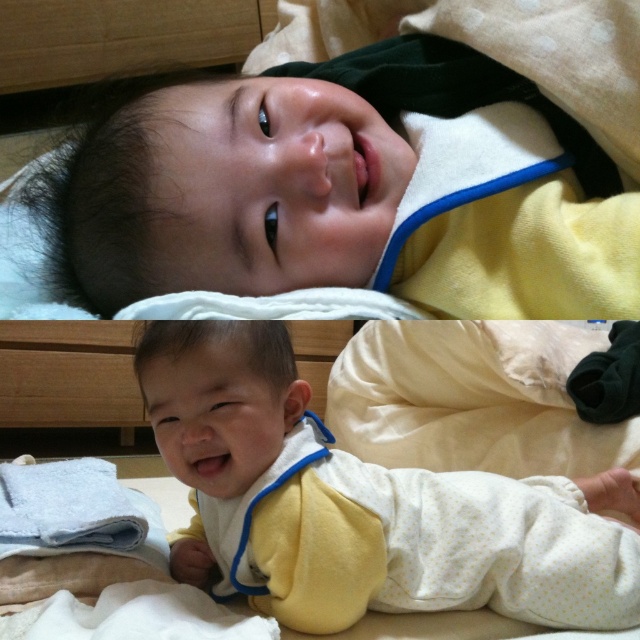
Question: Which point appears closest to the camera in this image?

Choices:
 (A) (561, 109)
 (B) (250, 480)

Answer: (A)

Question: Where is yellow fleece baby at upper center located in relation to yellow dotted fabric at center in the image?

Choices:
 (A) below
 (B) above

Answer: (B)

Question: Which point is closer to the camera?

Choices:
 (A) (202, 445)
 (B) (602, 161)

Answer: (B)

Question: From the image, what is the correct spatial relationship of yellow fleece baby at upper center in relation to yellow dotted fabric at center?

Choices:
 (A) below
 (B) above

Answer: (B)

Question: Does yellow fleece baby at upper center appear over yellow dotted fabric at center?

Choices:
 (A) yes
 (B) no

Answer: (A)